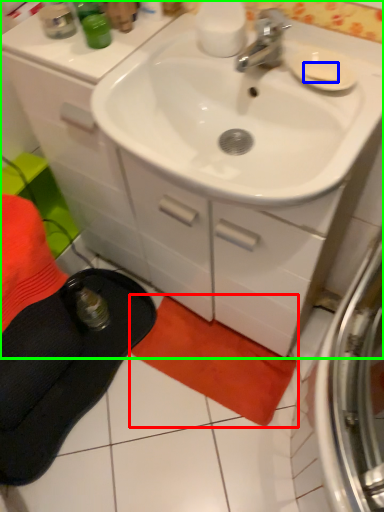
Question: Considering the real-world distances, which object is farthest from beach towel (highlighted by a red box)? soap (highlighted by a blue box) or bathroom cabinet (highlighted by a green box)?

Choices:
 (A) soap
 (B) bathroom cabinet

Answer: (A)